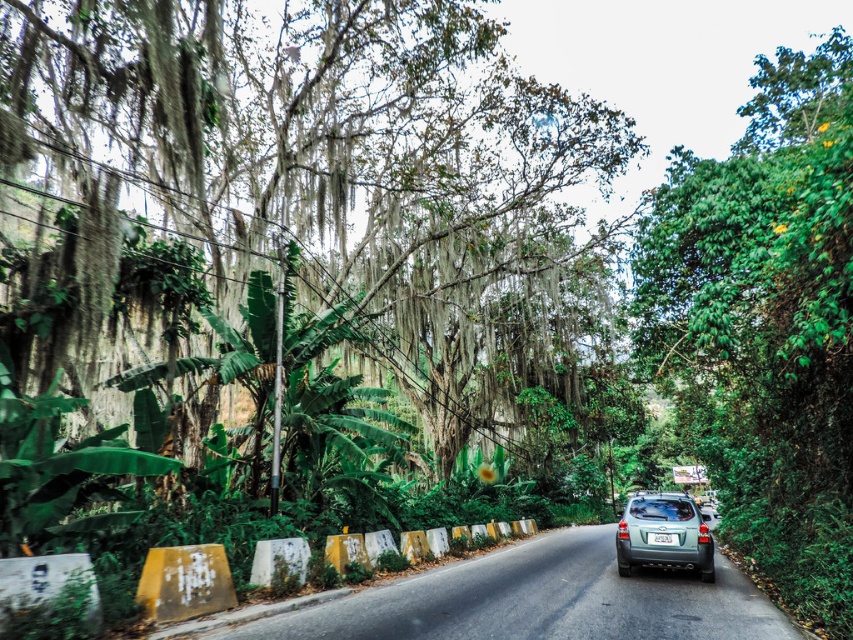
Question: Can you confirm if green leafy tree at center is bigger than slate metallic suv at center?

Choices:
 (A) no
 (B) yes

Answer: (B)

Question: Observing the image, what is the correct spatial positioning of green leafy tree at center in reference to slate metallic suv at center?

Choices:
 (A) right
 (B) left

Answer: (B)

Question: Among these objects, which one is nearest to the camera?

Choices:
 (A) green leafy tree at right
 (B) yellow painted concrete barriers at lower center
 (C) green leafy tree at center

Answer: (B)

Question: Which object appears farthest from the camera in this image?

Choices:
 (A) yellow painted concrete barriers at lower center
 (B) green leafy tree at right
 (C) slate metallic suv at center

Answer: (C)

Question: Is green leafy tree at right to the left of white plastic license plate at center from the viewer's perspective?

Choices:
 (A) no
 (B) yes

Answer: (A)

Question: Which of the following is the farthest from the observer?

Choices:
 (A) white plastic license plate at center
 (B) green leafy tree at center
 (C) yellow painted concrete barriers at lower center
 (D) green leafy tree at right

Answer: (A)